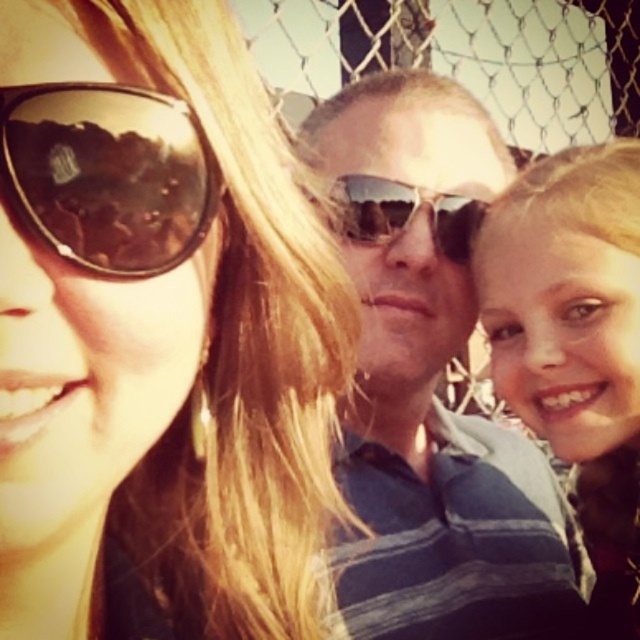
You are a photographer trying to adjust the focus of your camera to capture both the matte blue shirt at center and the blonde hair at center clearly. What is the minimum distance your camera needs to be able to focus on to ensure both are sharp?

The minimum focusing distance required is 11.51 centimeters because the matte blue shirt at center and the blonde hair at center are 11.51 centimeters apart, so the camera must be able to focus clearly at that distance to capture both details.